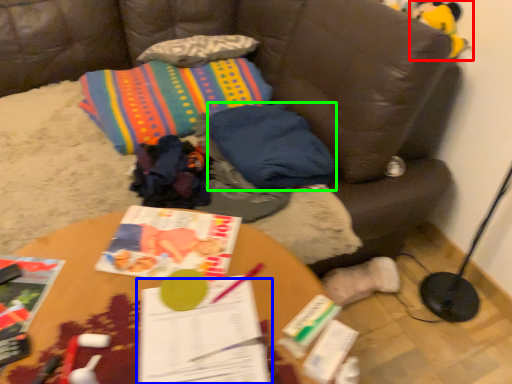
Question: Estimate the real-world distances between objects in this image. Which object is farther from toy (highlighted by a red box), book (highlighted by a blue box) or pillow (highlighted by a green box)?

Choices:
 (A) book
 (B) pillow

Answer: (A)